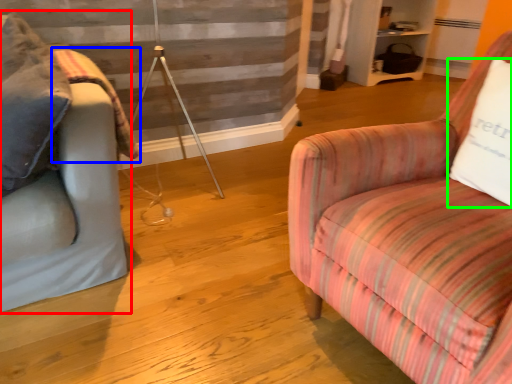
Question: Which is farther away from studio couch (highlighted by a red box)? blanket (highlighted by a blue box) or pillow (highlighted by a green box)?

Choices:
 (A) blanket
 (B) pillow

Answer: (B)